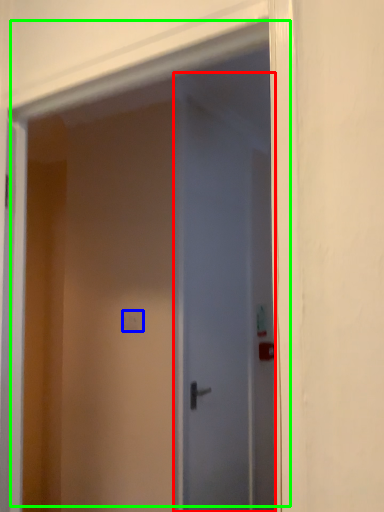
Question: Estimate the real-world distances between objects in this image. Which object is closer to door (highlighted by a red box), light switch (highlighted by a blue box) or door (highlighted by a green box)?

Choices:
 (A) light switch
 (B) door

Answer: (B)